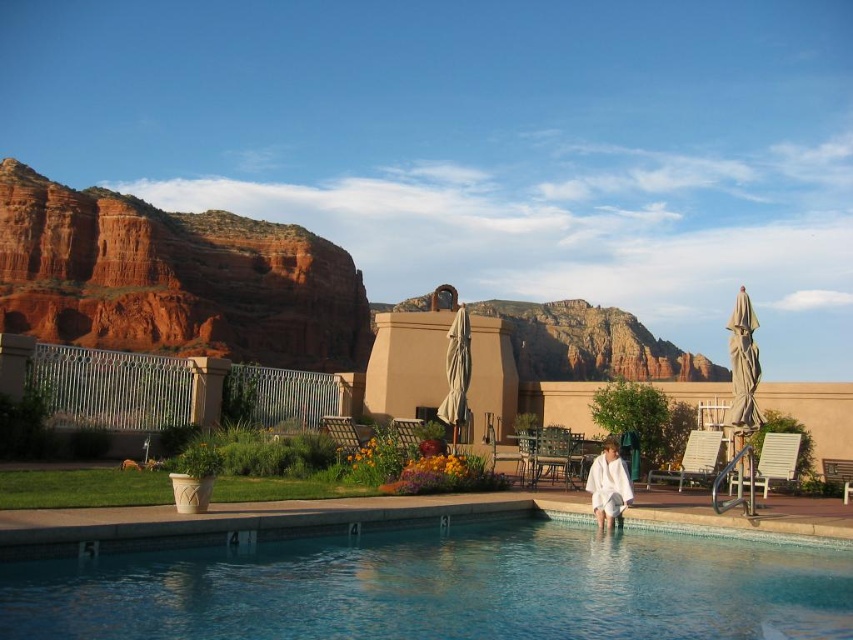
Question: Is clear glass swimming pool at lower center above white cotton robe at lower right?

Choices:
 (A) no
 (B) yes

Answer: (A)

Question: Is clear glass swimming pool at lower center bigger than reddish-brown rock at upper left?

Choices:
 (A) no
 (B) yes

Answer: (A)

Question: Based on their relative distances, which object is farther from the reddish-brown rock at upper left?

Choices:
 (A) white cotton robe at lower right
 (B) clear glass swimming pool at lower center

Answer: (A)

Question: Can you confirm if clear glass swimming pool at lower center is wider than reddish-brown rock at upper left?

Choices:
 (A) no
 (B) yes

Answer: (A)

Question: Among these objects, which one is farthest from the camera?

Choices:
 (A) white cotton robe at lower right
 (B) reddish-brown rock at upper left

Answer: (B)

Question: Which point is closer to the camera?

Choices:
 (A) (59, 257)
 (B) (363, 616)

Answer: (B)